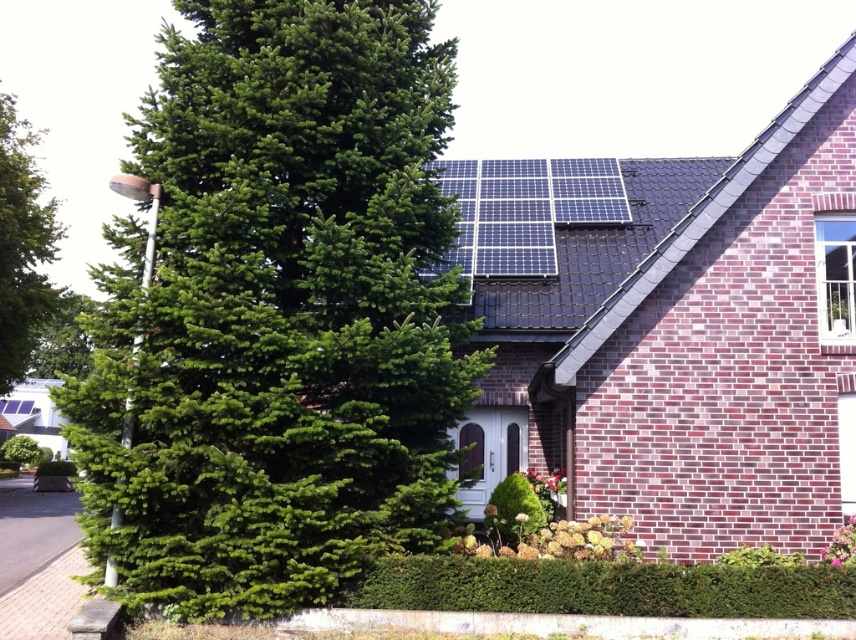
Question: Does green matte tree at center appear on the left side of green leafy tree at left?

Choices:
 (A) yes
 (B) no

Answer: (B)

Question: Is green matte tree at center to the right of green leafy tree at left from the viewer's perspective?

Choices:
 (A) yes
 (B) no

Answer: (A)

Question: Which object is farther from the camera taking this photo?

Choices:
 (A) green matte tree at center
 (B) green leafy tree at left

Answer: (B)

Question: Among these objects, which one is nearest to the camera?

Choices:
 (A) green matte tree at center
 (B) green leafy tree at left

Answer: (A)

Question: Which point is closer to the camera taking this photo?

Choices:
 (A) (364, 108)
 (B) (54, 234)

Answer: (A)

Question: Is green matte tree at center above green leafy tree at left?

Choices:
 (A) no
 (B) yes

Answer: (A)